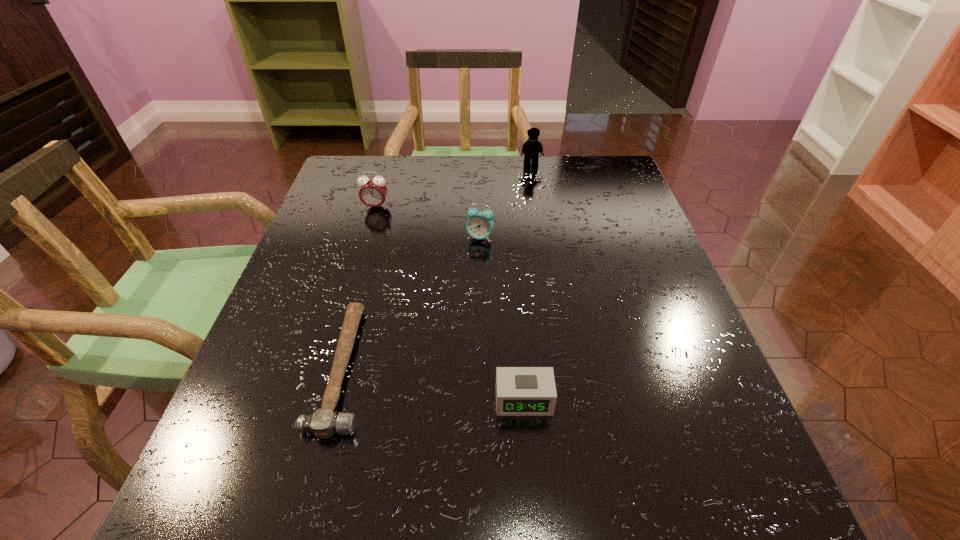
You are a GUI agent. You are given a task and a screenshot of the screen. Output one action in this format:
    pyautogui.click(x=<x>, y=<y>)
    Task: Click on the vacant area between the Lego and the fourth nearest object
    This screenshot has width=960, height=540.
    Given the screenshot: What is the action you would take?
    pyautogui.click(x=453, y=186)

Identify the location of vacant region between the shortest alarm clock and the second nearest alarm clock. This screenshot has width=960, height=540. tap(501, 319).

The height and width of the screenshot is (540, 960). Identify the location of the second closest object to the third farthest object. (323, 423).

Locate which object is the closest to the shortest object. Please provide its 2D coordinates. Your answer should be formatted as a tuple, i.e. [(x, y)], where the tuple contains the x and y coordinates of a point satisfying the conditions above.

[(520, 391)]

Identify which alarm clock is located as the third nearest to the hammer. Please provide its 2D coordinates. Your answer should be formatted as a tuple, i.e. [(x, y)], where the tuple contains the x and y coordinates of a point satisfying the conditions above.

[(373, 191)]

Find the location of `alarm clock that stands as the second closest to the third farthest object`. alarm clock that stands as the second closest to the third farthest object is located at coordinates (520, 391).